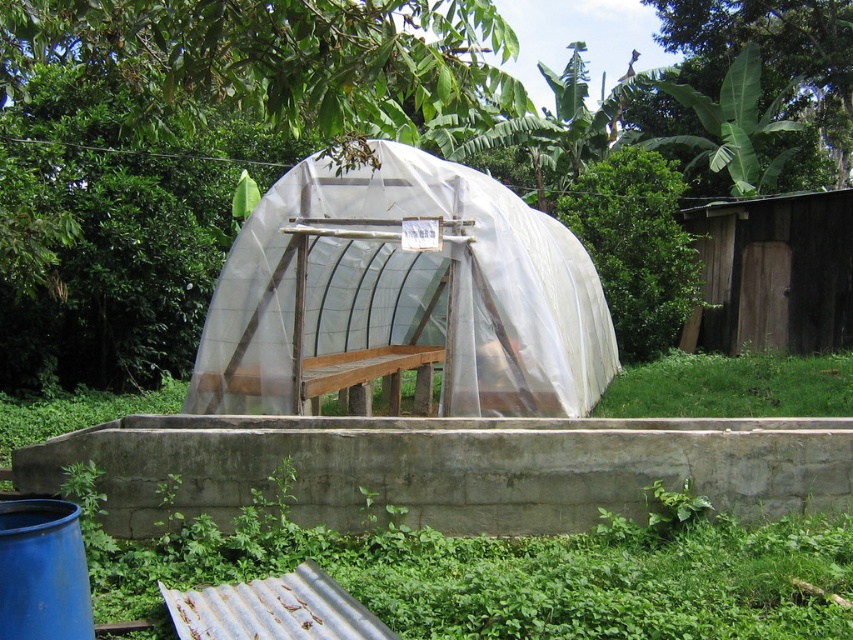
Question: Estimate the real-world distances between objects in this image. Which object is closer to the wooden shed at right?

Choices:
 (A) green leafy plant at lower left
 (B) green grass at lower right
 (C) transparent plastic hut at center

Answer: (B)

Question: Among these objects, which one is nearest to the camera?

Choices:
 (A) green grass at lower right
 (B) green leafy plant at lower left

Answer: (B)

Question: Which point is closer to the camera?

Choices:
 (A) (659, 384)
 (B) (820, 216)
 (C) (488, 605)
 (D) (480, 378)

Answer: (C)

Question: Is transparent plastic hut at center bigger than wooden shed at right?

Choices:
 (A) no
 (B) yes

Answer: (A)

Question: Is the position of transparent plastic hut at center less distant than that of wooden shed at right?

Choices:
 (A) yes
 (B) no

Answer: (A)

Question: Can you confirm if transparent plastic hut at center is positioned to the left of green leafy plant at lower left?

Choices:
 (A) yes
 (B) no

Answer: (A)